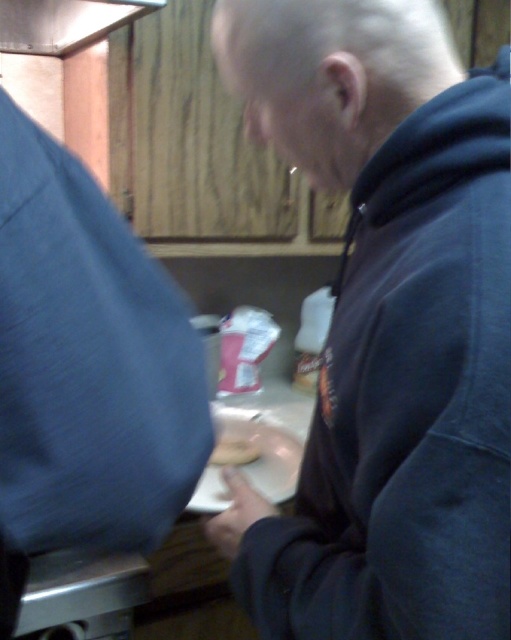
Question: In this image, where is silver metallic oven at lower left located relative to metallic silver exhaust hood at upper left?

Choices:
 (A) above
 (B) below

Answer: (B)

Question: Which point is closer to the camera?

Choices:
 (A) (81, 29)
 (B) (88, 586)

Answer: (B)

Question: Can you confirm if dark blue hoodie at center is positioned above metallic silver exhaust hood at upper left?

Choices:
 (A) no
 (B) yes

Answer: (A)

Question: Which of the following is the farthest from the observer?

Choices:
 (A) metallic silver exhaust hood at upper left
 (B) dark blue hoodie at center
 (C) silver metallic oven at lower left

Answer: (A)

Question: Which point appears farthest from the camera in this image?

Choices:
 (A) click(x=28, y=588)
 (B) click(x=11, y=16)
 (C) click(x=384, y=115)

Answer: (B)

Question: Does silver metallic oven at lower left have a larger size compared to metallic silver exhaust hood at upper left?

Choices:
 (A) no
 (B) yes

Answer: (A)